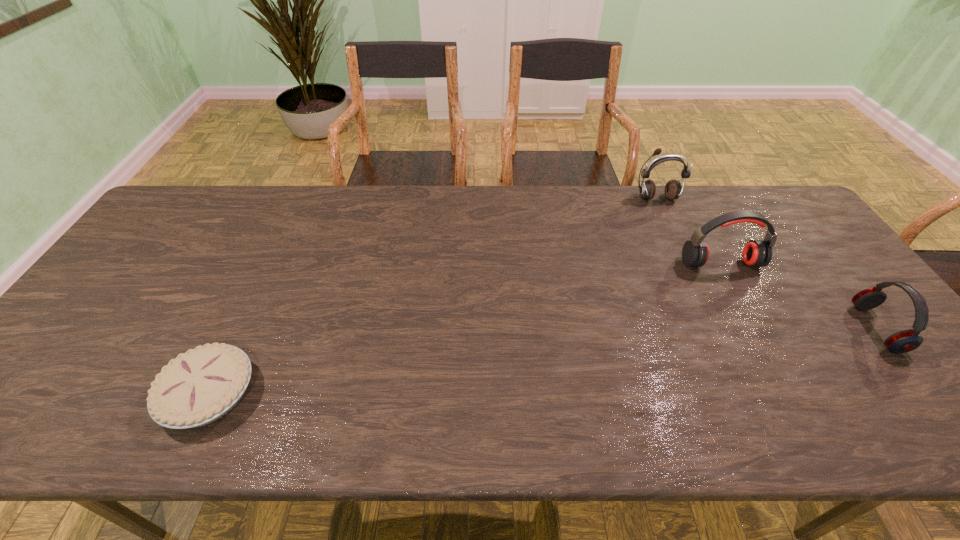
Where is `free point located 0.260m on the ear cups of the shortest earphone`? free point located 0.260m on the ear cups of the shortest earphone is located at coordinates (758, 329).

You are a GUI agent. You are given a task and a screenshot of the screen. Output one action in this format:
    pyautogui.click(x=<x>, y=<y>)
    Task: Click on the vacant space located 0.150m on the left of the leftmost object
    
    Given the screenshot: What is the action you would take?
    pyautogui.click(x=96, y=394)

Where is `object located at the far edge`? This screenshot has width=960, height=540. object located at the far edge is located at coordinates (673, 189).

At what (x,y) coordinates should I click in order to perform the action: click on object that is at the near edge. Please return your answer as a coordinate pair (x, y). Looking at the image, I should click on (200, 386).

Where is `object located at the right edge`? This screenshot has height=540, width=960. object located at the right edge is located at coordinates (904, 341).

The width and height of the screenshot is (960, 540). Identify the location of free region at the far edge. (392, 185).

Where is `vacant space at the near edge of the desktop`? The height and width of the screenshot is (540, 960). vacant space at the near edge of the desktop is located at coordinates (491, 428).

At what (x,y) coordinates should I click in order to perform the action: click on vacant position at the left edge of the desktop. Please return your answer as a coordinate pair (x, y). The height and width of the screenshot is (540, 960). Looking at the image, I should click on (166, 281).

The image size is (960, 540). Find the location of `free space at the right edge of the desktop`. free space at the right edge of the desktop is located at coordinates (848, 282).

Image resolution: width=960 pixels, height=540 pixels. I want to click on vacant space at the far right corner, so click(x=749, y=187).